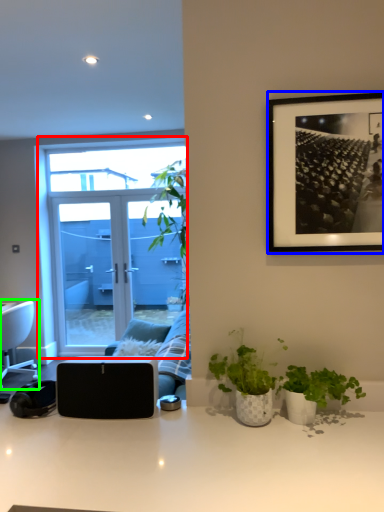
Question: Based on their relative distances, which object is nearer to window (highlighted by a red box)? Choose from picture frame (highlighted by a blue box) and chair (highlighted by a green box).

Choices:
 (A) picture frame
 (B) chair

Answer: (B)